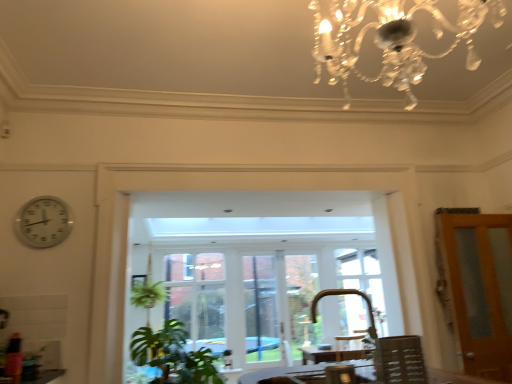
Question: Is brown wooden door at right positioned far away from white wood window frame at center?

Choices:
 (A) no
 (B) yes

Answer: (B)

Question: From a real-world perspective, does brown wooden door at right stand above white wood window frame at center?

Choices:
 (A) yes
 (B) no

Answer: (A)

Question: Is brown wooden door at right located outside white wood window frame at center?

Choices:
 (A) no
 (B) yes

Answer: (B)

Question: Is brown wooden door at right thinner than white wood window frame at center?

Choices:
 (A) yes
 (B) no

Answer: (B)

Question: From the image's perspective, is brown wooden door at right under white wood window frame at center?

Choices:
 (A) no
 (B) yes

Answer: (A)

Question: Is point (181, 360) positioned closer to the camera than point (38, 235)?

Choices:
 (A) farther
 (B) closer

Answer: (A)

Question: Is green leafy plant at lower left bigger or smaller than white plastic clock at left?

Choices:
 (A) small
 (B) big

Answer: (B)

Question: Choose the correct answer: Is green leafy plant at lower left inside white plastic clock at left or outside it?

Choices:
 (A) outside
 (B) inside

Answer: (A)

Question: From a real-world perspective, is green leafy plant at lower left physically located above or below white plastic clock at left?

Choices:
 (A) above
 (B) below

Answer: (B)

Question: Is white wood window frame at center spatially inside green leafy plant at lower left, or outside of it?

Choices:
 (A) outside
 (B) inside

Answer: (A)

Question: Looking at their shapes, would you say white wood window frame at center is wider or thinner than green leafy plant at lower left?

Choices:
 (A) wide
 (B) thin

Answer: (B)

Question: In terms of height, does white wood window frame at center look taller or shorter compared to green leafy plant at lower left?

Choices:
 (A) short
 (B) tall

Answer: (B)

Question: Considering the relative positions of white wood window frame at center and green leafy plant at lower left in the image provided, is white wood window frame at center to the left or to the right of green leafy plant at lower left?

Choices:
 (A) left
 (B) right

Answer: (B)

Question: Is brown wooden door at right bigger or smaller than wooden table at lower center?

Choices:
 (A) big
 (B) small

Answer: (A)

Question: Considering the positions of brown wooden door at right and wooden table at lower center in the image, is brown wooden door at right taller or shorter than wooden table at lower center?

Choices:
 (A) tall
 (B) short

Answer: (A)